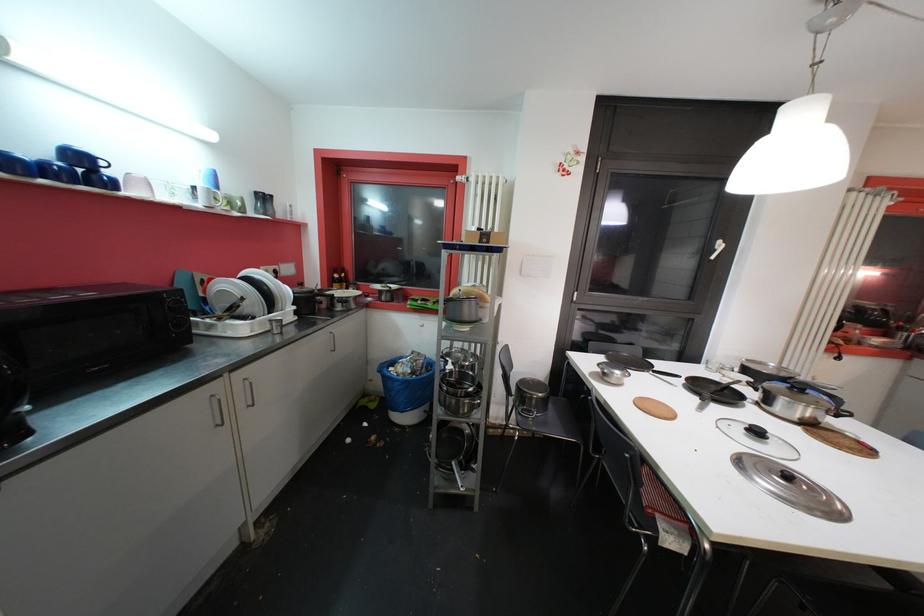
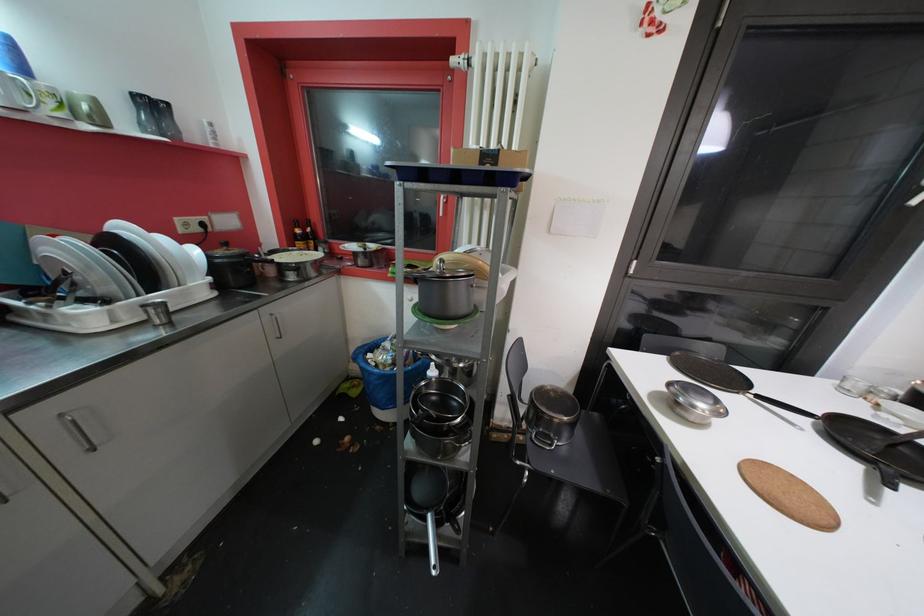
Question: The images are taken continuously from a first-person perspective. In which direction is your viewpoint rotating?

Choices:
 (A) Left
 (B) Right
 (C) Up
 (D) Down

Answer: (D)